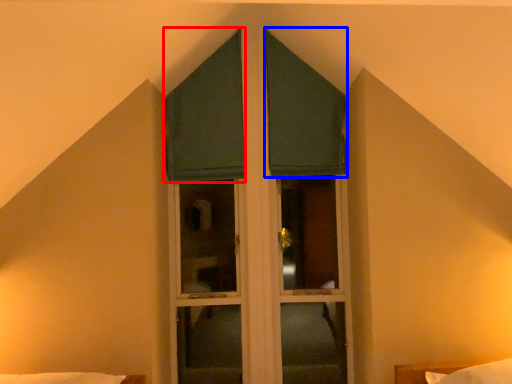
Question: Which of the following is the closest to the observer, curtain (highlighted by a red box) or curtain (highlighted by a blue box)?

Choices:
 (A) curtain
 (B) curtain

Answer: (A)